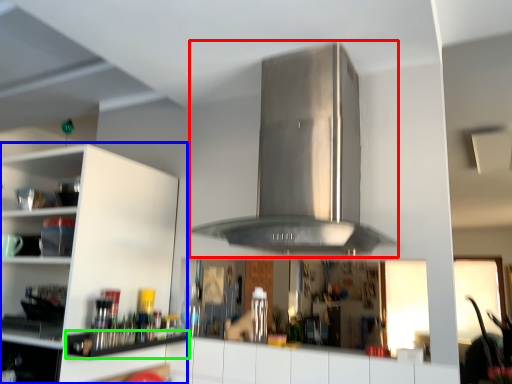
Question: Which object is positioned farthest from vent (highlighted by a red box)? Select from cabinetry (highlighted by a blue box) and shelf (highlighted by a green box).

Choices:
 (A) cabinetry
 (B) shelf

Answer: (B)